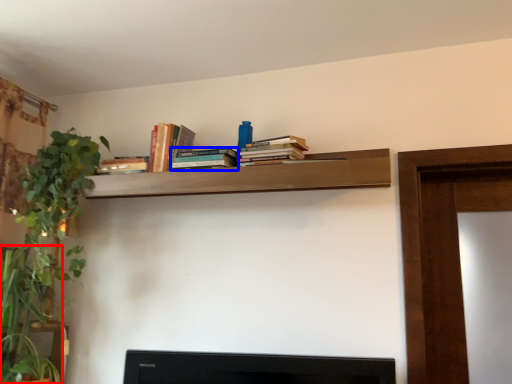
Question: Which point is closer to the camera, plant (highlighted by a red box) or book (highlighted by a blue box)?

Choices:
 (A) plant
 (B) book

Answer: (A)